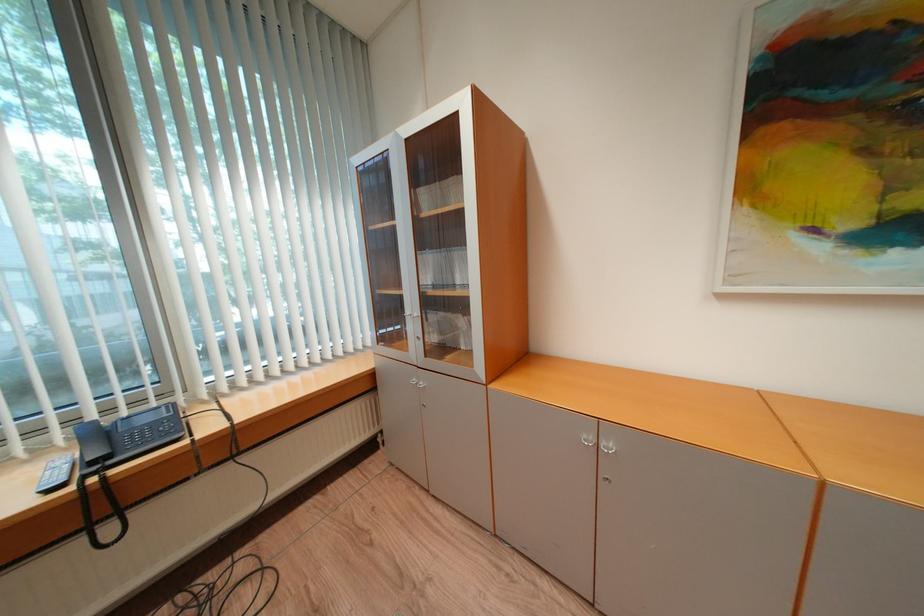
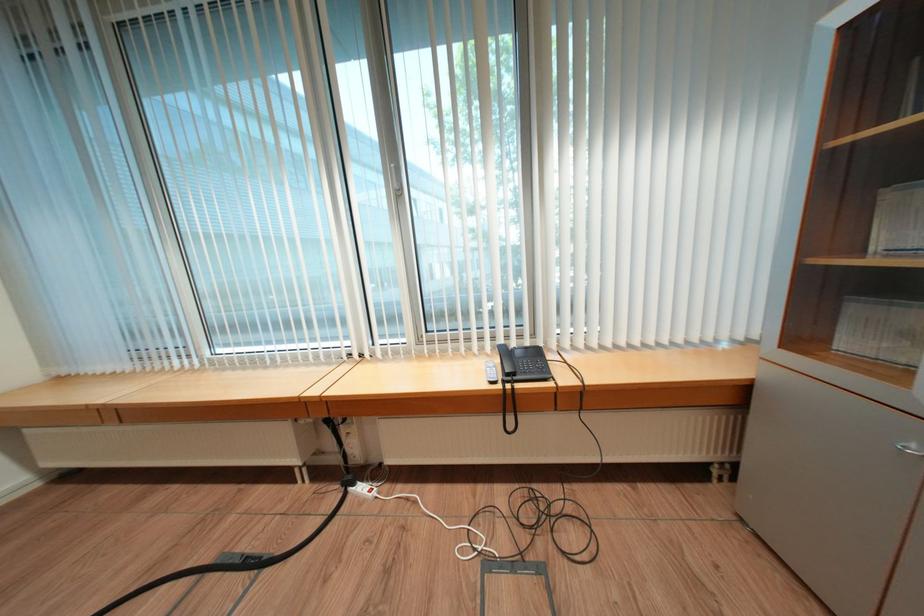
Question: The camera is either moving clockwise (left) or counter-clockwise (right) around the object. The first image is from the beginning of the video and the second image is from the end. Is the camera moving left or right when shooting the video?

Choices:
 (A) Left
 (B) Right

Answer: (B)